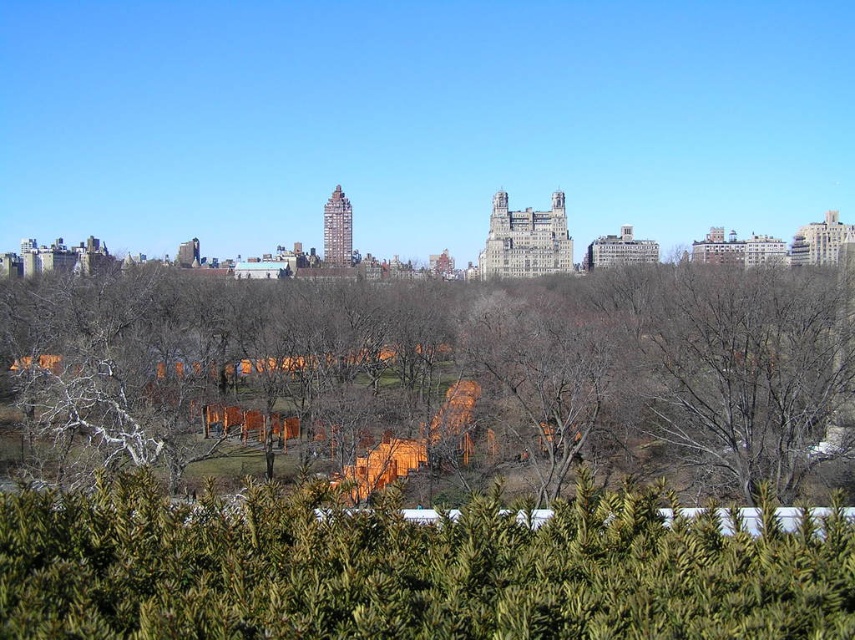
Can you confirm if brown wood fence at center is positioned below green textured hedge at lower center?

Incorrect, brown wood fence at center is not positioned below green textured hedge at lower center.

Is brown wood fence at center to the right of green textured hedge at lower center from the viewer's perspective?

No, brown wood fence at center is not to the right of green textured hedge at lower center.

Identify the location of brown wood fence at center. The width and height of the screenshot is (855, 640). pyautogui.click(x=453, y=365).

The width and height of the screenshot is (855, 640). I want to click on brown wood fence at center, so click(x=453, y=365).